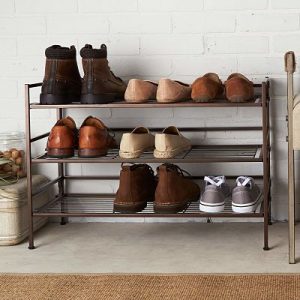
The height and width of the screenshot is (300, 300). I want to click on pairs of shoes, so click(x=225, y=198), click(x=150, y=190), click(x=148, y=147), click(x=77, y=139), click(x=89, y=72), click(x=153, y=90), click(x=228, y=87).